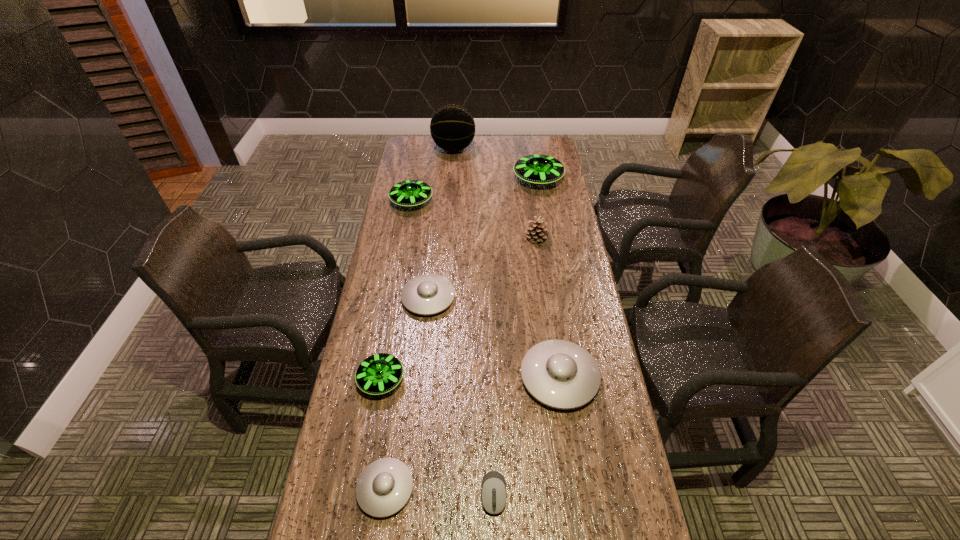
In the image, there is a desktop. Identify the location of free space at the right edge. (594, 307).

Where is `vacant area at the far right corner of the desktop`? vacant area at the far right corner of the desktop is located at coordinates (540, 149).

The height and width of the screenshot is (540, 960). I want to click on free space between the fifth shortest saucer and the fourth farthest object, so click(x=474, y=220).

Where is `free spot between the nearest green saucer and the nearest gray saucer`? free spot between the nearest green saucer and the nearest gray saucer is located at coordinates (383, 434).

At what (x,y) coordinates should I click in order to perform the action: click on blank region between the rightmost gray saucer and the fourth object from right to left. Please return your answer as a coordinate pair (x, y). The width and height of the screenshot is (960, 540). Looking at the image, I should click on (526, 435).

The image size is (960, 540). Identify the location of vacant area between the fifth shortest saucer and the sixth object from left to right. (453, 348).

Locate an element on the screen. The image size is (960, 540). unoccupied area between the shortest object and the rightmost gray saucer is located at coordinates (526, 435).

Find the location of a particular element. empty location between the rightmost green saucer and the fourth object from right to left is located at coordinates (516, 337).

Where is `unoccupied position between the smallest green saucer and the biggest gray saucer`? Image resolution: width=960 pixels, height=540 pixels. unoccupied position between the smallest green saucer and the biggest gray saucer is located at coordinates (470, 379).

In order to click on free space between the shortest object and the brown pinecone in this screenshot , I will do `click(516, 366)`.